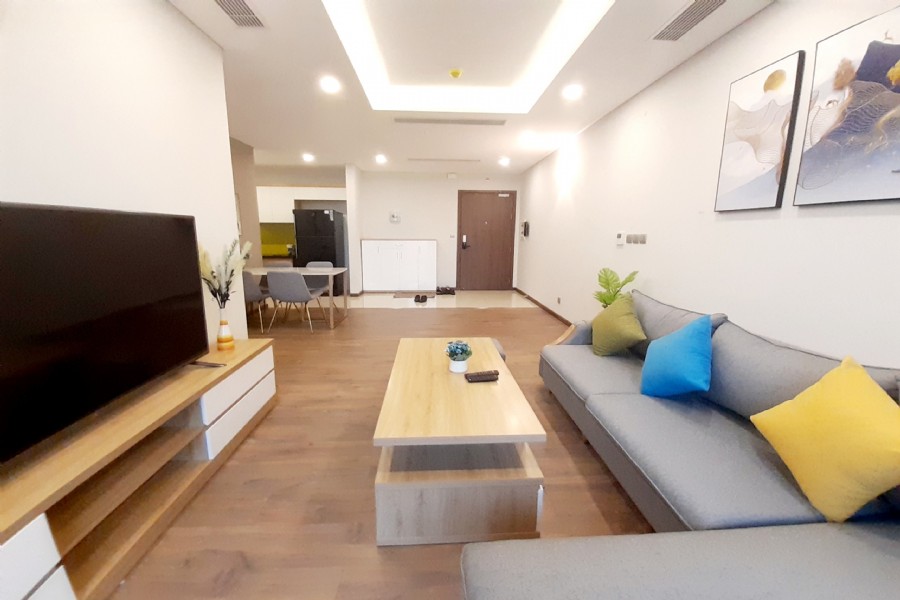
Identify the location of coffee table. (456, 401).